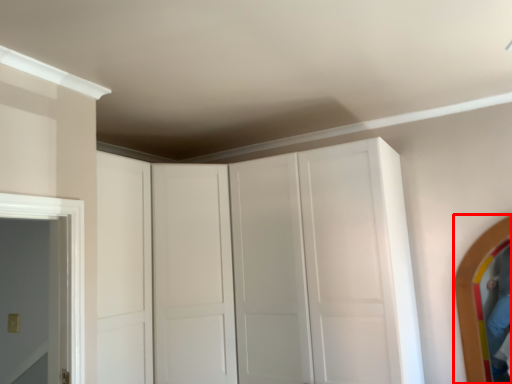
Question: Considering the relative positions of mirror (annotated by the red box) and dresser in the image provided, where is mirror (annotated by the red box) located with respect to the staircase?

Choices:
 (A) right
 (B) left

Answer: (A)